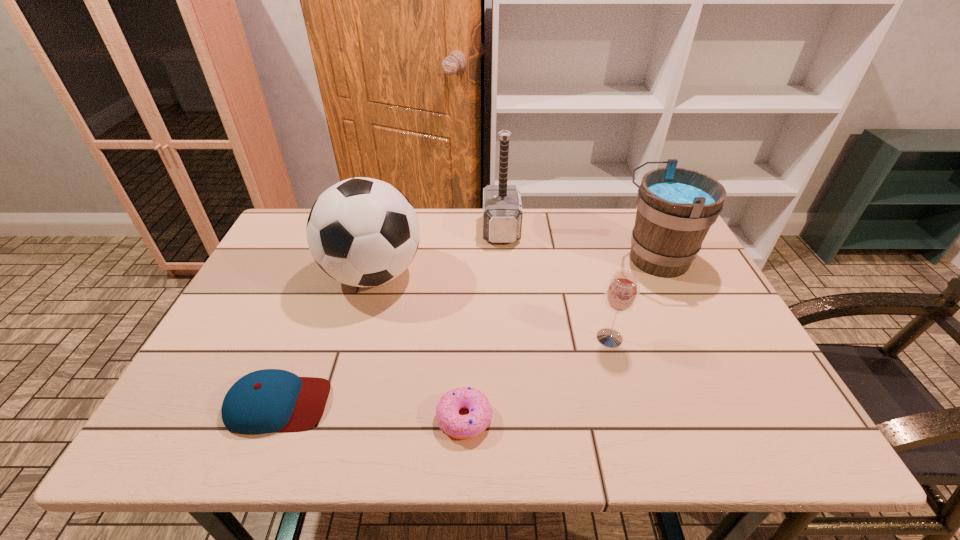
In order to click on free space that satisfies the following two spatial constraints: 1. with a handle on the side of the rightmost object; 2. on the front side of the second object from right to left in this screenshot , I will do `click(692, 338)`.

This screenshot has width=960, height=540. I want to click on free point that satisfies the following two spatial constraints: 1. for striking with the head of the wineglass; 2. on the right side of the hammer, so click(x=508, y=338).

The height and width of the screenshot is (540, 960). I want to click on vacant space that satisfies the following two spatial constraints: 1. on the front side of the fourth tallest object; 2. with the bill of the baseball cap facing forward, so click(x=629, y=403).

Locate an element on the screen. Image resolution: width=960 pixels, height=540 pixels. free spot that satisfies the following two spatial constraints: 1. on the front side of the soccer ball; 2. on the left side of the wineglass is located at coordinates (355, 338).